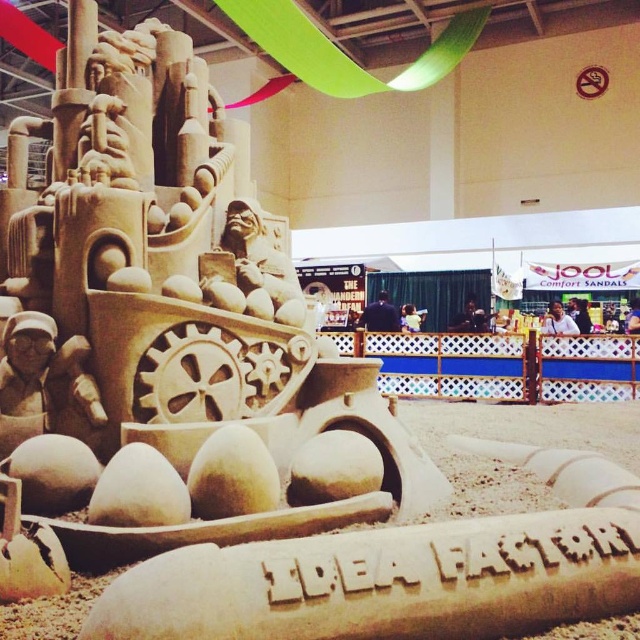
Question: Considering the relative positions of sand sculpture at center and beige sand sculpture at lower center in the image provided, where is sand sculpture at center located with respect to beige sand sculpture at lower center?

Choices:
 (A) above
 (B) below

Answer: (A)

Question: Is sand sculpture at center to the right of beige sand sculpture at lower center from the viewer's perspective?

Choices:
 (A) yes
 (B) no

Answer: (B)

Question: Does sand sculpture at center come behind beige sand sculpture at lower center?

Choices:
 (A) yes
 (B) no

Answer: (B)